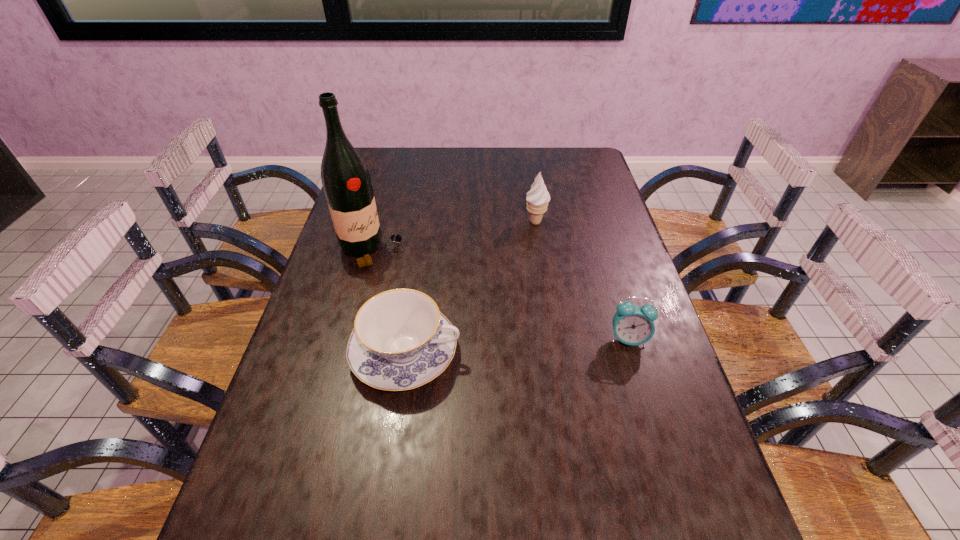
You are a GUI agent. You are given a task and a screenshot of the screen. Output one action in this format:
    pyautogui.click(x=<x>, y=<y>)
    Task: Click on the blank area located on the surface of the second farthest object
    
    Given the screenshot: What is the action you would take?
    pyautogui.click(x=420, y=280)

In order to click on vacant area located on the front-facing side of the farthest object in this screenshot , I will do `click(536, 245)`.

Image resolution: width=960 pixels, height=540 pixels. Identify the location of vacant space positioned 0.170m on the front-facing side of the farthest object. (535, 265).

This screenshot has width=960, height=540. I want to click on vacant space located 0.070m on the front-facing side of the farthest object, so click(x=536, y=243).

Identify the location of chinaware that is positioned at the left edge. (400, 341).

This screenshot has height=540, width=960. In order to click on wine bottle that is at the left edge in this screenshot , I will do [x=346, y=181].

You are a GUI agent. You are given a task and a screenshot of the screen. Output one action in this format:
    pyautogui.click(x=<x>, y=<y>)
    Task: Click on the object that is at the right edge
    The height and width of the screenshot is (540, 960).
    Given the screenshot: What is the action you would take?
    pyautogui.click(x=633, y=325)

In the image, there is a desktop. Find the location of `vacant space at the far edge`. vacant space at the far edge is located at coordinates (452, 168).

Locate an element on the screen. This screenshot has width=960, height=540. vacant space at the near edge of the desktop is located at coordinates 565,512.

Locate an element on the screen. free location at the left edge is located at coordinates (356, 308).